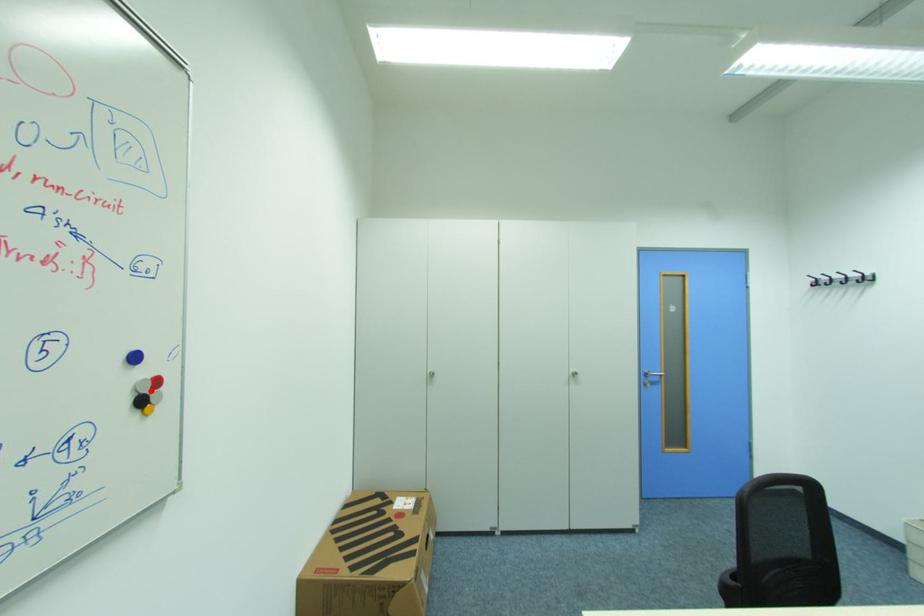
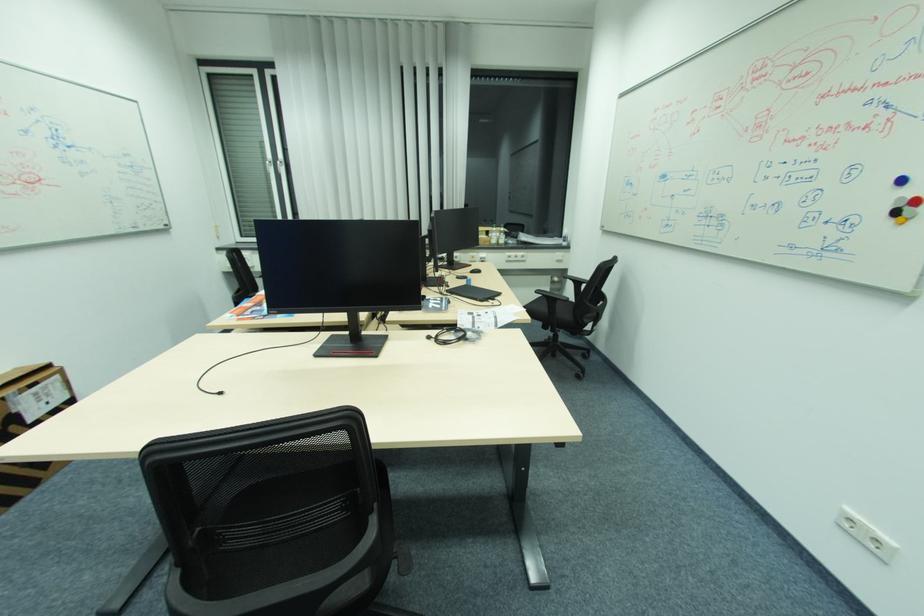
Locate, in the second image, the point that corresponds to the highlighted location in the first image.

(907, 206)